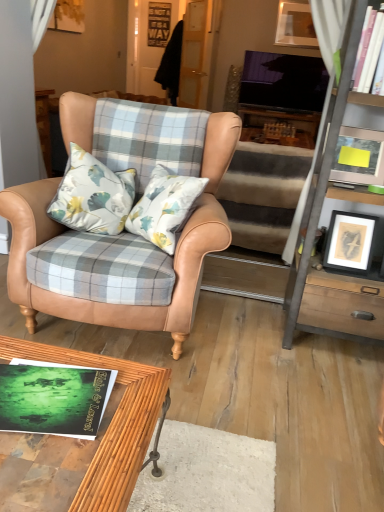
This screenshot has height=512, width=384. Describe the element at coordinates (318, 222) in the screenshot. I see `metallic gray cabinet at right` at that location.

Identify the location of green matte book at lower left. The image size is (384, 512). (53, 398).

The image size is (384, 512). Describe the element at coordinates (258, 391) in the screenshot. I see `white carpet at lower center` at that location.

At what (x,y) coordinates should I click in order to perform the action: click on bamboo wood coffee table at lower center. Please return your answer as a coordinate pair (x, y). Looking at the image, I should click on (110, 422).

How much space does black matte picture frame at right, marked as the 2th picture frame in a back-to-front arrangement, occupy horizontally?

black matte picture frame at right, marked as the 2th picture frame in a back-to-front arrangement, is 6.56 inches in width.

Where is `metallic gray cabinet at right`? metallic gray cabinet at right is located at coordinates (318, 222).

Is white carpet at lower center looking in the opposite direction of white glossy bookshelf at upper right?

No, white glossy bookshelf at upper right is not at the back of white carpet at lower center.

Is white glossy bookshelf at upper right inside white carpet at lower center?

No, white glossy bookshelf at upper right is not a part of white carpet at lower center.

Considering the sizes of white carpet at lower center and white glossy bookshelf at upper right in the image, is white carpet at lower center taller or shorter than white glossy bookshelf at upper right?

Clearly, white carpet at lower center is shorter compared to white glossy bookshelf at upper right.

Is white carpet at lower center in contact with white glossy bookshelf at upper right?

There is a gap between white carpet at lower center and white glossy bookshelf at upper right.

Find the location of a particular element. This screenshot has width=384, height=512. carpets below the matte gray picture frame at upper right, which is the 3th picture frame from back to front (from a real-world perspective) is located at coordinates (258, 391).

Does matte gray picture frame at upper right, the 3th picture frame positioned from the right, turn towards white carpet at lower center?

No, matte gray picture frame at upper right, the 3th picture frame positioned from the right, is not facing towards white carpet at lower center.

Based on their sizes in the image, would you say matte gray picture frame at upper right, the 3th picture frame positioned from the right, is bigger or smaller than white carpet at lower center?

In the image, matte gray picture frame at upper right, the 3th picture frame positioned from the right, appears to be smaller than white carpet at lower center.

Can you tell me how much matte gray picture frame at upper right, arranged as the 2th picture frame when ordered from the bottom, and white carpet at lower center differ in facing direction?

The angular difference between matte gray picture frame at upper right, arranged as the 2th picture frame when ordered from the bottom, and white carpet at lower center is 173 degrees.

The image size is (384, 512). What are the coordinates of `book located on the left of white glossy bookshelf at upper right` in the screenshot? It's located at (x=53, y=398).

Considering the sizes of white glossy bookshelf at upper right and green matte book at lower left in the image, is white glossy bookshelf at upper right taller or shorter than green matte book at lower left?

In the image, white glossy bookshelf at upper right appears to be taller than green matte book at lower left.

Is white glossy bookshelf at upper right turned away from green matte book at lower left?

No, green matte book at lower left is not at the back of white glossy bookshelf at upper right.

Between white glossy bookshelf at upper right and green matte book at lower left, which one has larger size?

white glossy bookshelf at upper right is bigger.

From a real-world perspective, is matte gray picture frame at upper right, the 3th picture frame positioned from the right, physically located above or below white glossy bookshelf at upper right?

matte gray picture frame at upper right, the 3th picture frame positioned from the right, is situated lower than white glossy bookshelf at upper right in the real world.

From the image's perspective, is matte gray picture frame at upper right, which is the 3th picture frame from back to front, located beneath white glossy bookshelf at upper right?

Yes, from the image's perspective, matte gray picture frame at upper right, which is the 3th picture frame from back to front, is below white glossy bookshelf at upper right.

From the picture: Are matte gray picture frame at upper right, which is the 3th picture frame from back to front, and white glossy bookshelf at upper right far apart?

No, matte gray picture frame at upper right, which is the 3th picture frame from back to front, is not far from white glossy bookshelf at upper right.

Who is smaller, matte gray picture frame at upper right, which is the 3th picture frame from back to front, or white glossy bookshelf at upper right?

Smaller between the two is matte gray picture frame at upper right, which is the 3th picture frame from back to front.

Considering the sizes of objects white glossy bookshelf at upper right and black matte picture frame at right, the first picture frame when ordered from bottom to top, in the image provided, who is taller, white glossy bookshelf at upper right or black matte picture frame at right, the first picture frame when ordered from bottom to top,?

With more height is black matte picture frame at right, the first picture frame when ordered from bottom to top.

Is white glossy bookshelf at upper right next to black matte picture frame at right, arranged as the second picture frame when viewed from the left, and touching it?

No, white glossy bookshelf at upper right is not with black matte picture frame at right, arranged as the second picture frame when viewed from the left.

From a real-world perspective, between white glossy bookshelf at upper right and black matte picture frame at right, the 2th picture frame viewed from the right, who is vertically lower?

From a 3D spatial view, black matte picture frame at right, the 2th picture frame viewed from the right, is below.

Considering the sizes of objects white glossy bookshelf at upper right and black matte picture frame at right, the 2th picture frame viewed from the right, in the image provided, who is thinner, white glossy bookshelf at upper right or black matte picture frame at right, the 2th picture frame viewed from the right,?

black matte picture frame at right, the 2th picture frame viewed from the right.

Is beige carpeted stairs at center to the right of bamboo wood coffee table at lower center from the viewer's perspective?

Indeed, beige carpeted stairs at center is positioned on the right side of bamboo wood coffee table at lower center.

Are beige carpeted stairs at center and bamboo wood coffee table at lower center far apart?

Yes, beige carpeted stairs at center is far from bamboo wood coffee table at lower center.

From the image's perspective, which object appears higher, beige carpeted stairs at center or bamboo wood coffee table at lower center?

beige carpeted stairs at center is shown above in the image.

Is beige carpeted stairs at center facing away from bamboo wood coffee table at lower center?

Yes.

From a real-world perspective, relative to matte gray picture frame at upper right, which is the 3th picture frame from back to front, is beige carpeted stairs at center vertically above or below?

From a real-world perspective, beige carpeted stairs at center is physically below matte gray picture frame at upper right, which is the 3th picture frame from back to front.

Is beige carpeted stairs at center bigger than matte gray picture frame at upper right, which is the 3th picture frame from back to front?

Yes.

Considering the positions of objects beige carpeted stairs at center and matte gray picture frame at upper right, the 1th picture frame positioned from the front, in the image provided, who is in front, beige carpeted stairs at center or matte gray picture frame at upper right, the 1th picture frame positioned from the front,?

matte gray picture frame at upper right, the 1th picture frame positioned from the front.

You are a GUI agent. You are given a task and a screenshot of the screen. Output one action in this format:
    pyautogui.click(x=<x>, y=<y>)
    Task: Click on the carpets in front of the white glossy bookshelf at upper right
    
    Given the screenshot: What is the action you would take?
    pyautogui.click(x=258, y=391)

Where is `carpets below the matte gray picture frame at upper right, which is the 3th picture frame from back to front (from the image's perspective)`? The height and width of the screenshot is (512, 384). carpets below the matte gray picture frame at upper right, which is the 3th picture frame from back to front (from the image's perspective) is located at coordinates 258,391.

From the image, which object appears to be nearer to bamboo wood coffee table at lower center, black matte picture frame at right, arranged as the second picture frame when viewed from the left, or green matte book at lower left?

The object closer to bamboo wood coffee table at lower center is green matte book at lower left.

Looking at the image, which one is located closer to black matte picture frame at right, the 2th picture frame in the front-to-back sequence, beige carpeted stairs at center or green matte book at lower left?

beige carpeted stairs at center lies closer to black matte picture frame at right, the 2th picture frame in the front-to-back sequence, than the other object.

From the image, which object appears to be farther from matte wooden picture frame at upper right, which is the third picture frame in front-to-back order, black matte picture frame at right, the third picture frame in the top-to-bottom sequence, or white carpet at lower center?

Among the two, white carpet at lower center is located further to matte wooden picture frame at upper right, which is the third picture frame in front-to-back order.

Based on their spatial positions, is matte wooden picture frame at upper right, the third picture frame when ordered from left to right, or tan leather chair at center further from green matte book at lower left?

matte wooden picture frame at upper right, the third picture frame when ordered from left to right, lies further to green matte book at lower left than the other object.

Based on their spatial positions, is matte gray picture frame at upper right, the 3th picture frame positioned from the right, or bamboo wood coffee table at lower center further from matte wooden picture frame at upper right, which is the third picture frame in front-to-back order?

bamboo wood coffee table at lower center.

Estimate the real-world distances between objects in this image. Which object is closer to matte wooden picture frame at upper right, which is counted as the 1th picture frame, starting from the back, white glossy bookshelf at upper right or metallic gray cabinet at right?

metallic gray cabinet at right is closer to matte wooden picture frame at upper right, which is counted as the 1th picture frame, starting from the back.

Which object lies further to the anchor point metallic gray cabinet at right, beige carpeted stairs at center or matte wooden picture frame at upper right, acting as the 1th picture frame starting from the top?

matte wooden picture frame at upper right, acting as the 1th picture frame starting from the top.

When comparing their distances from white carpet at lower center, does green matte book at lower left or white glossy bookshelf at upper right seem further?

white glossy bookshelf at upper right.

The height and width of the screenshot is (512, 384). I want to click on cabinetry between white glossy bookshelf at upper right and white carpet at lower center vertically, so click(x=318, y=222).

Locate an element on the screen. The height and width of the screenshot is (512, 384). shelf between green matte book at lower left and matte wooden picture frame at upper right, which is the third picture frame in front-to-back order, along the z-axis is located at coordinates (368, 51).

In order to click on book between white glossy bookshelf at upper right and white carpet at lower center vertically in this screenshot , I will do `click(53, 398)`.

The height and width of the screenshot is (512, 384). I want to click on carpets between green matte book at lower left and beige carpeted stairs at center from front to back, so click(258, 391).